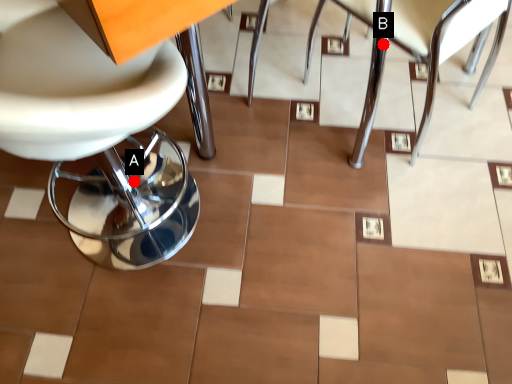
Question: Two points are circled on the image, labeled by A and B beside each circle. Which point is further to the camera?

Choices:
 (A) A is further
 (B) B is further

Answer: (A)